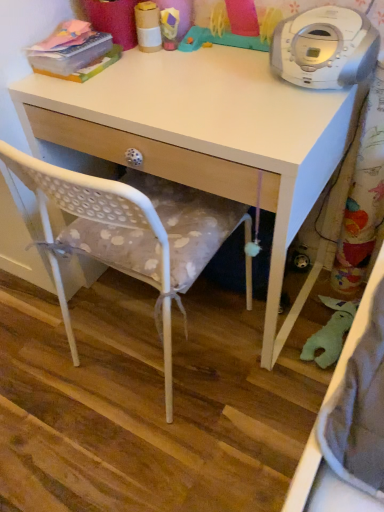
The image size is (384, 512). What are the coordinates of `free location to the right of cardboard tube at upper center, which is the 1th toy from left to right` in the screenshot? It's located at (210, 54).